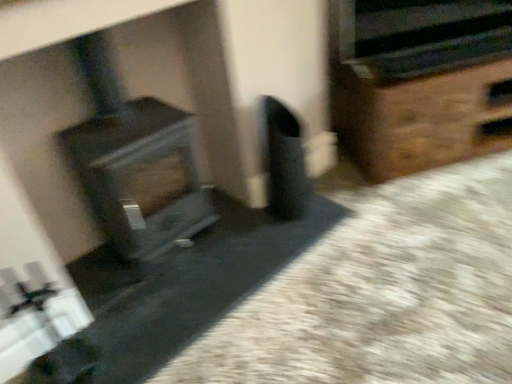
Measure the distance between wood grain stove at left and camera.

wood grain stove at left and camera are 4.46 feet apart from each other.

Where is `wood grain stove at left`? The image size is (512, 384). wood grain stove at left is located at coordinates (134, 162).

Identify the location of metallic silver stereo at upper right. (423, 35).

I want to click on wood grain stove at left, so click(x=134, y=162).

Is brown wooden chest at right behind metallic silver stereo at upper right?

Yes, brown wooden chest at right is further from the viewer.

Is brown wooden chest at right oriented towards metallic silver stereo at upper right?

No, brown wooden chest at right is not oriented towards metallic silver stereo at upper right.

From a real-world perspective, is brown wooden chest at right over metallic silver stereo at upper right?

No, from a real-world perspective, brown wooden chest at right is not over metallic silver stereo at upper right

Relative to wood grain stove at left, is metallic silver stereo at upper right in front or behind?

Visually, metallic silver stereo at upper right is located behind wood grain stove at left.

Is the surface of metallic silver stereo at upper right in direct contact with wood grain stove at left?

No, metallic silver stereo at upper right is not touching wood grain stove at left.

From a real-world perspective, is metallic silver stereo at upper right below wood grain stove at left?

No, from a real-world perspective, metallic silver stereo at upper right is not under wood grain stove at left.

Is point (111, 83) positioned behind point (411, 68)?

No.

Between wood grain stove at left and metallic silver stereo at upper right, which one is positioned in front?

Positioned in front is wood grain stove at left.

Who is taller, wood grain stove at left or metallic silver stereo at upper right?

With more height is wood grain stove at left.

Who is bigger, wood grain stove at left or metallic silver stereo at upper right?

With larger size is wood grain stove at left.

Is metallic silver stereo at upper right at the right side of brown wooden chest at right?

No.

From the image's perspective, is metallic silver stereo at upper right over brown wooden chest at right?

Yes, from the image's perspective, metallic silver stereo at upper right is on top of brown wooden chest at right.

Can you confirm if metallic silver stereo at upper right is shorter than brown wooden chest at right?

Yes.

Considering the points (433, 44) and (412, 125), which point is behind, point (433, 44) or point (412, 125)?

The point (412, 125) is farther.

Considering the positions of points (190, 139) and (447, 0), is point (190, 139) farther from camera compared to point (447, 0)?

That is False.

In the scene shown: From a real-world perspective, who is located lower, wood grain stove at left or brown wooden chest at right?

brown wooden chest at right is physically lower.

How many degrees apart are the facing directions of wood grain stove at left and brown wooden chest at right?

The facing directions of wood grain stove at left and brown wooden chest at right are 28.7 degrees apart.

This screenshot has height=384, width=512. What are the coordinates of `furniture that is under the wood grain stove at left (from a real-world perspective)` in the screenshot? It's located at (420, 82).

How much distance is there between brown wooden chest at right and wood grain stove at left?

3.60 feet.

Between brown wooden chest at right and wood grain stove at left, which one has larger size?

brown wooden chest at right is bigger.

Is brown wooden chest at right facing away from wood grain stove at left?

brown wooden chest at right does not have its back to wood grain stove at left.

Where is `furniture that is on the right side of metallic silver stereo at upper right`? The image size is (512, 384). furniture that is on the right side of metallic silver stereo at upper right is located at coordinates (420, 82).

The width and height of the screenshot is (512, 384). Find the location of `stereo lying behind the wood grain stove at left`. stereo lying behind the wood grain stove at left is located at coordinates (423, 35).

From the image, which object appears to be nearer to wood grain stove at left, metallic silver stereo at upper right or brown wooden chest at right?

The object closer to wood grain stove at left is brown wooden chest at right.

Based on their spatial positions, is wood grain stove at left or brown wooden chest at right closer to metallic silver stereo at upper right?

brown wooden chest at right lies closer to metallic silver stereo at upper right than the other object.

Based on their spatial positions, is metallic silver stereo at upper right or wood grain stove at left further from brown wooden chest at right?

Based on the image, wood grain stove at left appears to be further to brown wooden chest at right.

From the image, which object appears to be nearer to wood grain stove at left, brown wooden chest at right or metallic silver stereo at upper right?

Based on the image, brown wooden chest at right appears to be nearer to wood grain stove at left.

Considering their positions, is wood grain stove at left positioned closer to brown wooden chest at right than metallic silver stereo at upper right?

Among the two, metallic silver stereo at upper right is located nearer to brown wooden chest at right.

From the image, which object appears to be farther from metallic silver stereo at upper right, brown wooden chest at right or wood grain stove at left?

wood grain stove at left.

The image size is (512, 384). In order to click on stereo located between wood grain stove at left and brown wooden chest at right in the left-right direction in this screenshot , I will do `click(423, 35)`.